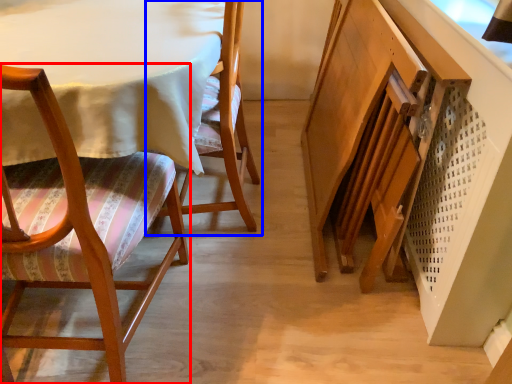
Question: Which object is further to the camera taking this photo, chair (highlighted by a red box) or chair (highlighted by a blue box)?

Choices:
 (A) chair
 (B) chair

Answer: (B)